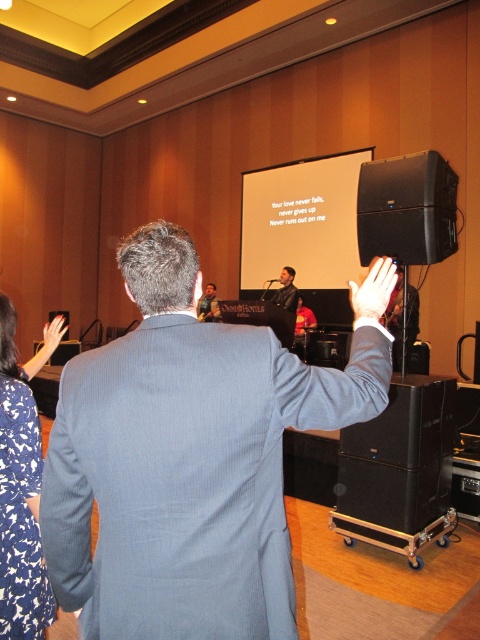
You are an event planner organizing a presentation. You need to ensure that the white matte projection screen at center and the matte black hand at upper left are positioned correctly for the audience. Based on their sizes, which object should be placed closer to the audience to maintain visibility?

The white matte projection screen at center has a lesser width compared to the matte black hand at upper left. To maintain visibility, the white matte projection screen at center should be placed closer to the audience since it is smaller in width and needs to be more accessible for clear viewing.